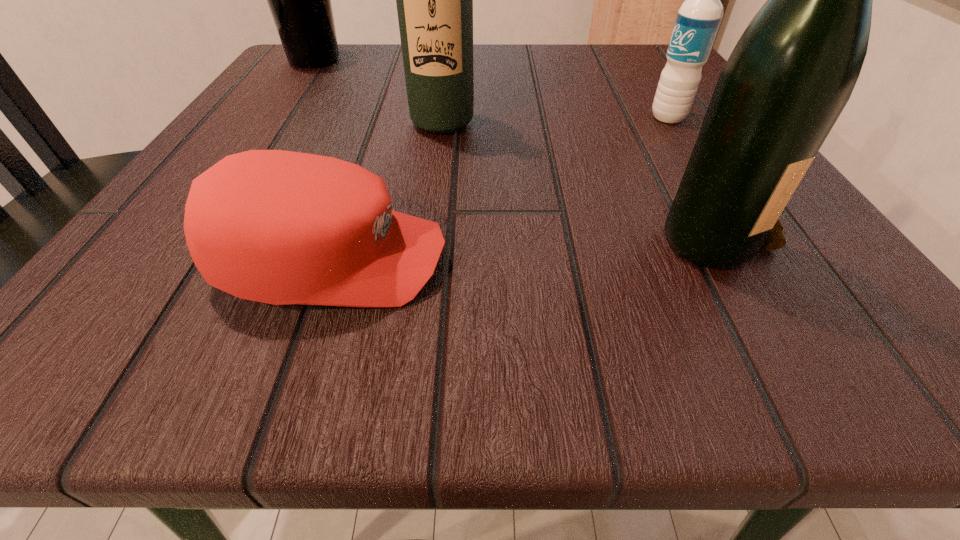
Where is `empty space that is in between the second shortest object and the second wine bottle from right to left`? empty space that is in between the second shortest object and the second wine bottle from right to left is located at coordinates (555, 120).

At what (x,y) coordinates should I click in order to perform the action: click on vacant region between the shortest object and the nearest wine bottle. Please return your answer as a coordinate pair (x, y). Looking at the image, I should click on (522, 246).

Locate an element on the screen. free space between the water bottle and the shortest object is located at coordinates (500, 189).

Locate an element on the screen. The height and width of the screenshot is (540, 960). vacant area that lies between the nearest wine bottle and the second nearest wine bottle is located at coordinates (578, 177).

Where is `vacant point located between the shortest object and the second shortest object`? The height and width of the screenshot is (540, 960). vacant point located between the shortest object and the second shortest object is located at coordinates (500, 189).

Image resolution: width=960 pixels, height=540 pixels. I want to click on vacant region between the farthest object and the rightmost wine bottle, so click(x=514, y=145).

Where is `vacant space that's between the fourth tallest object and the leftmost wine bottle`? The width and height of the screenshot is (960, 540). vacant space that's between the fourth tallest object and the leftmost wine bottle is located at coordinates (492, 89).

Locate which object is the second closest to the second farthest wine bottle. Please provide its 2D coordinates. Your answer should be formatted as a tuple, i.e. [(x, y)], where the tuple contains the x and y coordinates of a point satisfying the conditions above.

[(299, 0)]

The width and height of the screenshot is (960, 540). I want to click on object that is the fourth closest to the shortest object, so click(x=299, y=0).

This screenshot has height=540, width=960. I want to click on wine bottle that stands as the third closest to the water bottle, so click(299, 0).